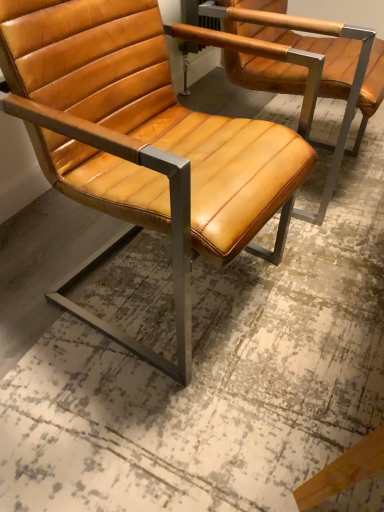
Where is `free spot to the right of matte leather chair at center`? This screenshot has height=512, width=384. free spot to the right of matte leather chair at center is located at coordinates (327, 280).